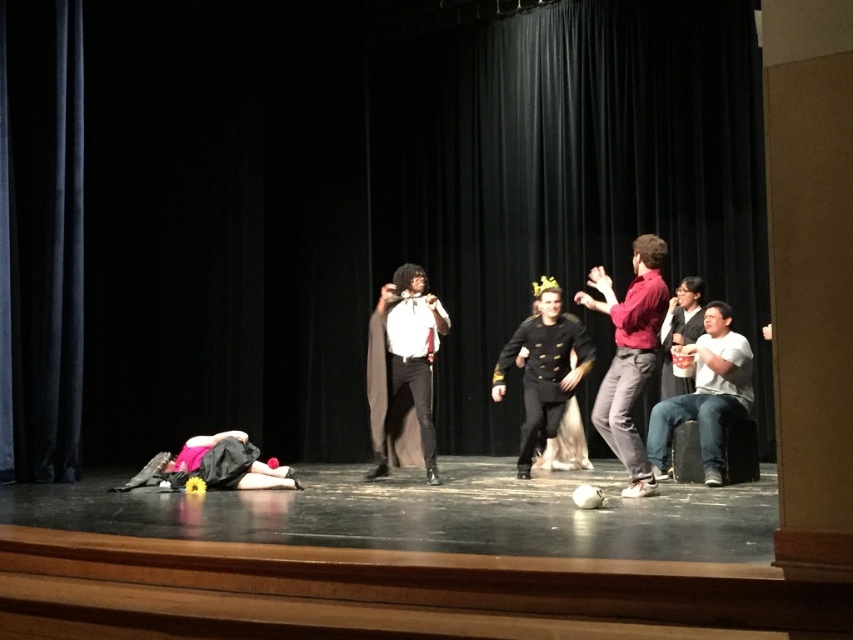
Consider the image. Can you confirm if matte black cape at center is taller than jeans at right?

Yes.

Can you confirm if matte black cape at center is shorter than jeans at right?

No, matte black cape at center is not shorter than jeans at right.

This screenshot has height=640, width=853. What do you see at coordinates (403, 365) in the screenshot?
I see `matte black cape at center` at bounding box center [403, 365].

You are a GUI agent. You are given a task and a screenshot of the screen. Output one action in this format:
    pyautogui.click(x=<x>, y=<y>)
    Task: Click on the matte black cape at center
    The width and height of the screenshot is (853, 640).
    Given the screenshot: What is the action you would take?
    pyautogui.click(x=403, y=365)

Does black velvet curtain at center have a larger size compared to jeans at right?

No, black velvet curtain at center is not bigger than jeans at right.

Which is above, black velvet curtain at center or jeans at right?

Positioned higher is black velvet curtain at center.

Does point (610, 246) lie in front of point (746, 356)?

No.

Where is `black velvet curtain at center`? The image size is (853, 640). black velvet curtain at center is located at coordinates (344, 204).

Does matte red shirt at center have a smaller size compared to black matte uniform at center?

Yes, matte red shirt at center is smaller than black matte uniform at center.

Between matte red shirt at center and black matte uniform at center, which one appears on the right side from the viewer's perspective?

From the viewer's perspective, matte red shirt at center appears more on the right side.

Where is `matte red shirt at center`? Image resolution: width=853 pixels, height=640 pixels. matte red shirt at center is located at coordinates (630, 355).